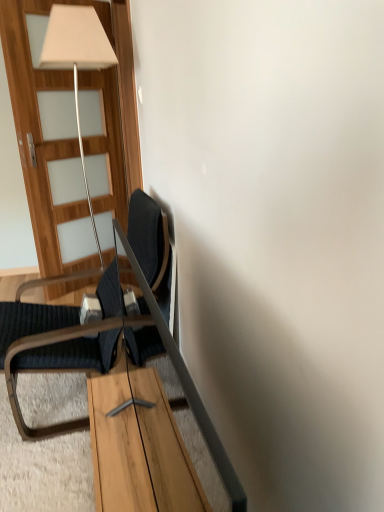
Question: From the image's perspective, is dark blue fabric chair at left positioned above or below wooden table at center?

Choices:
 (A) below
 (B) above

Answer: (B)

Question: Looking at their shapes, would you say dark blue fabric chair at left is wider or thinner than wooden table at center?

Choices:
 (A) wide
 (B) thin

Answer: (A)

Question: Considering the real-world distances, which object is closest to the wooden table at center?

Choices:
 (A) dark blue fabric chair at left
 (B) wooden door at left

Answer: (A)

Question: Which is farther from the wooden table at center?

Choices:
 (A) wooden door at left
 (B) dark blue fabric chair at left

Answer: (A)